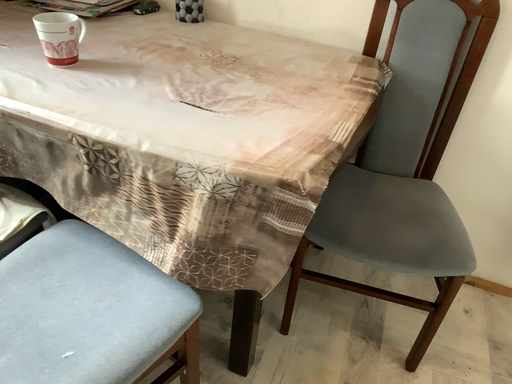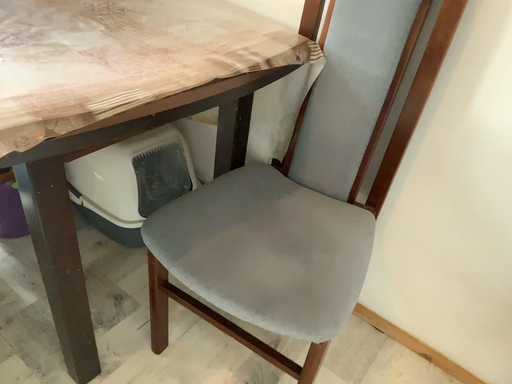
Question: Which way did the camera rotate in the video?

Choices:
 (A) rotated left
 (B) rotated right

Answer: (A)